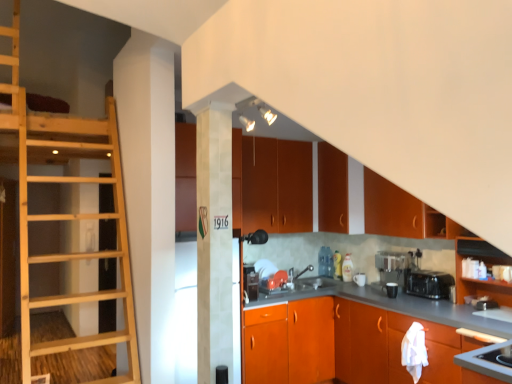
Where is `vacant space behind matte black coffee maker at lower center, positioned as the first appliance in back-to-front order`? vacant space behind matte black coffee maker at lower center, positioned as the first appliance in back-to-front order is located at coordinates click(377, 294).